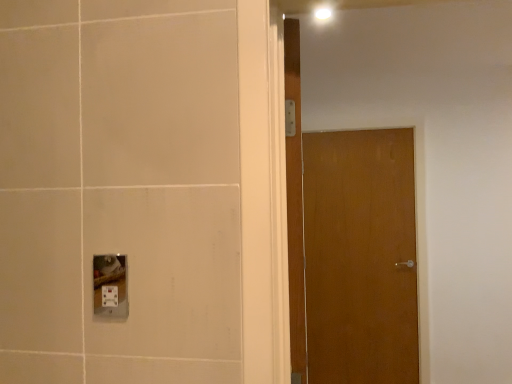
Question: Which direction should I rotate to look at wooden door at center, the 1th door when ordered from left to right?

Choices:
 (A) left
 (B) right

Answer: (B)

Question: Are wooden door at center, the 1th door when ordered from left to right, and wooden door at center, marked as the first door in a right-to-left arrangement, far apart?

Choices:
 (A) yes
 (B) no

Answer: (A)

Question: Is wooden door at center, placed as the second door when sorted from right to left, not within wooden door at center, the second door viewed from the left?

Choices:
 (A) no
 (B) yes

Answer: (B)

Question: Can you confirm if wooden door at center, arranged as the first door when viewed from the front, is positioned to the right of wooden door at center, marked as the first door in a right-to-left arrangement?

Choices:
 (A) no
 (B) yes

Answer: (A)

Question: Can you confirm if wooden door at center, arranged as the first door when viewed from the front, is taller than wooden door at center, marked as the first door in a right-to-left arrangement?

Choices:
 (A) yes
 (B) no

Answer: (B)

Question: From the image's perspective, is wooden door at center, placed as the second door when sorted from right to left, beneath wooden door at center, marked as the first door in a right-to-left arrangement?

Choices:
 (A) no
 (B) yes

Answer: (A)

Question: Considering the relative sizes of wooden door at center, the 1th door when ordered from left to right, and wooden door at center, which is the second door from front to back, in the image provided, is wooden door at center, the 1th door when ordered from left to right, thinner than wooden door at center, which is the second door from front to back,?

Choices:
 (A) no
 (B) yes

Answer: (A)

Question: Is white plastic socket at lower left positioned with its back to wooden door at center, arranged as the first door when viewed from the front?

Choices:
 (A) yes
 (B) no

Answer: (B)

Question: Is white plastic socket at lower left taller than wooden door at center, which ranks as the second door in back-to-front order?

Choices:
 (A) no
 (B) yes

Answer: (A)

Question: Are white plastic socket at lower left and wooden door at center, the 1th door when ordered from left to right, located far from each other?

Choices:
 (A) no
 (B) yes

Answer: (A)

Question: From a real-world perspective, is white plastic socket at lower left beneath wooden door at center, the 1th door when ordered from left to right?

Choices:
 (A) no
 (B) yes

Answer: (B)

Question: Is white plastic socket at lower left at the right side of wooden door at center, placed as the second door when sorted from right to left?

Choices:
 (A) yes
 (B) no

Answer: (B)

Question: Is white plastic socket at lower left placed right next to wooden door at center, placed as the second door when sorted from right to left?

Choices:
 (A) no
 (B) yes

Answer: (A)

Question: Is wooden door at center, placed as the second door when sorted from right to left, to the left of white plastic socket at lower left from the viewer's perspective?

Choices:
 (A) yes
 (B) no

Answer: (B)